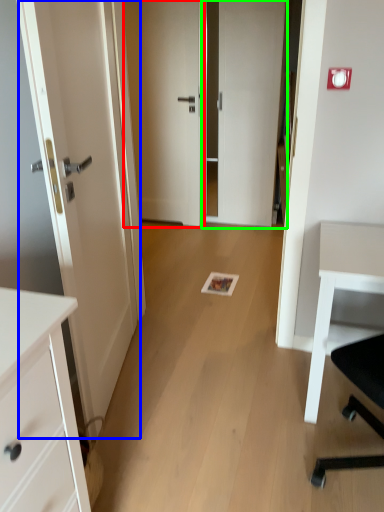
Question: Estimate the real-world distances between objects in this image. Which object is closer to door (highlighted by a red box), door (highlighted by a blue box) or door (highlighted by a green box)?

Choices:
 (A) door
 (B) door

Answer: (B)